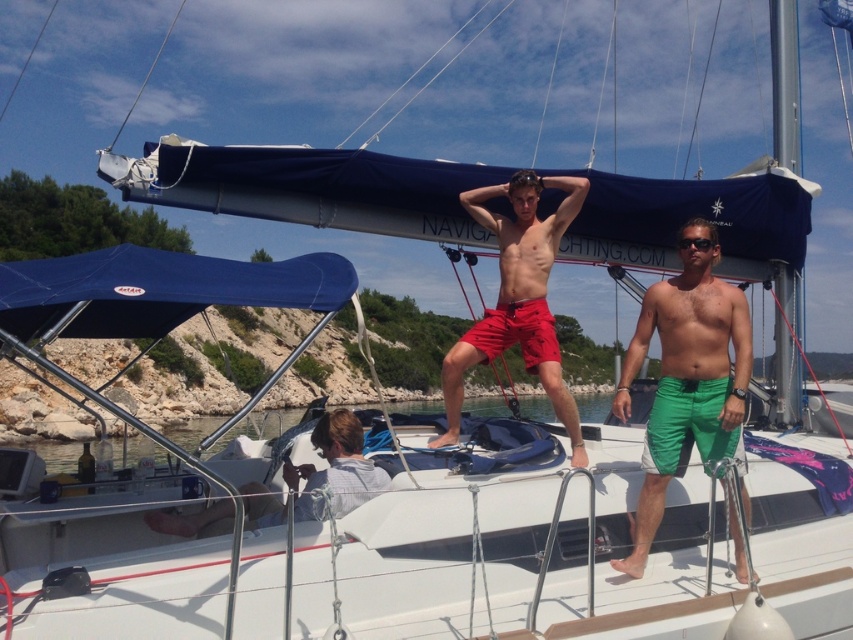
Question: Does green fabric shorts at center have a greater width compared to matte red shorts at center?

Choices:
 (A) no
 (B) yes

Answer: (A)

Question: Can you confirm if green fabric shorts at center is positioned above black plastic sunglasses at upper center?

Choices:
 (A) no
 (B) yes

Answer: (A)

Question: Among these points, which one is nearest to the camera?

Choices:
 (A) (451, 419)
 (B) (694, 236)

Answer: (B)

Question: Can you confirm if white cotton shirt at lower left is thinner than black plastic sunglasses at upper center?

Choices:
 (A) no
 (B) yes

Answer: (A)

Question: Which object is positioned farthest from the black plastic sunglasses at upper center?

Choices:
 (A) matte red shorts at center
 (B) white cotton shirt at lower left

Answer: (B)

Question: Which of the following is the closest to the observer?

Choices:
 (A) (682, 237)
 (B) (308, 486)
 (C) (511, 292)

Answer: (B)